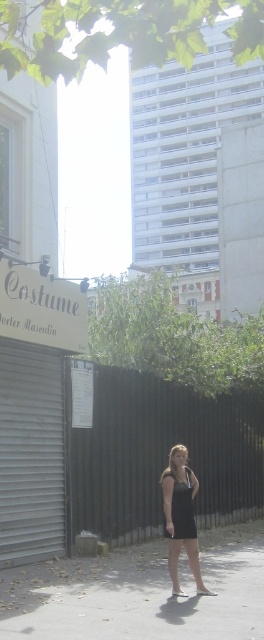
You are a delivery person needing to place a small package on the gray concrete pavement at lower center. Can you fit the package there without it overlapping the black satin dress at center?

The gray concrete pavement at lower center is bigger than the black satin dress at center, so yes, the package can be placed there without overlapping.

You are a window cleaner on the sidewalk and need to reach both the white matte sign at upper left and the black dress at center. Which object is closer to the ground?

The white matte sign at upper left is shorter than the black dress at center, so it is closer to the ground.

You are a delivery person trying to place a package on the gray concrete pavement at lower center. However, the black satin dress at center is in the way. Can you lift the dress to move it?

The gray concrete pavement at lower center has a greater height compared to black satin dress at center, so the dress is lower and can be lifted to move it out of the way.